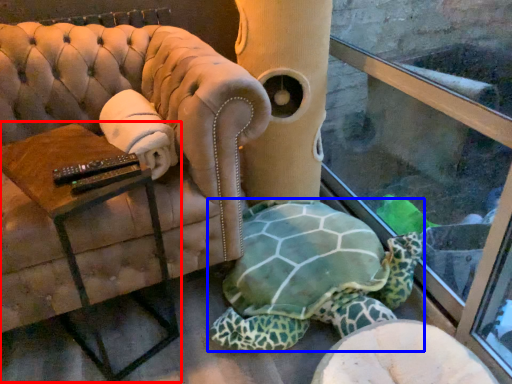
Question: Among these objects, which one is nearest to the camera, table (highlighted by a red box) or tortoise (highlighted by a blue box)?

Choices:
 (A) table
 (B) tortoise

Answer: (A)